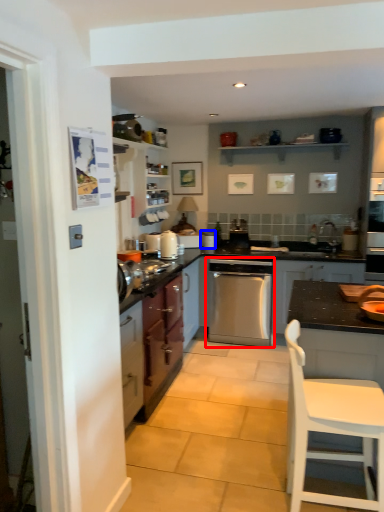
Question: Which object is closer to the camera taking this photo, home appliance (highlighted by a red box) or appliance (highlighted by a blue box)?

Choices:
 (A) home appliance
 (B) appliance

Answer: (A)